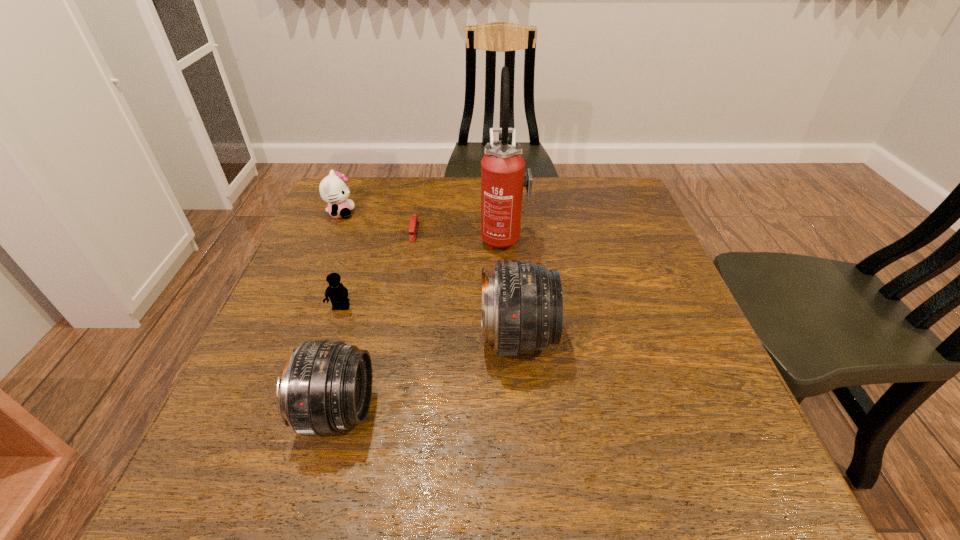
Identify the location of free region at the right edge of the desktop. The width and height of the screenshot is (960, 540). (691, 320).

Image resolution: width=960 pixels, height=540 pixels. I want to click on free point at the far left corner, so click(377, 184).

Identify the location of vacant point at the near left corner. This screenshot has height=540, width=960. (253, 396).

Identify the location of vacant space at the far right corner of the desktop. (583, 177).

At what (x,y) coordinates should I click in order to perform the action: click on blank space at the near right corner. Please return your answer as a coordinate pair (x, y). Looking at the image, I should click on (721, 394).

The image size is (960, 540). Find the location of `empty location between the kitten and the fire extinguisher`. empty location between the kitten and the fire extinguisher is located at coordinates (422, 225).

Where is `blank region between the shortest object and the Lego`? This screenshot has height=540, width=960. blank region between the shortest object and the Lego is located at coordinates (377, 269).

I want to click on free space between the shortest object and the kitten, so click(377, 222).

Find the location of a particular element. blank region between the second tallest object and the kitten is located at coordinates (428, 276).

Where is `free point between the stapler and the left telephoto lens`? The image size is (960, 540). free point between the stapler and the left telephoto lens is located at coordinates (375, 321).